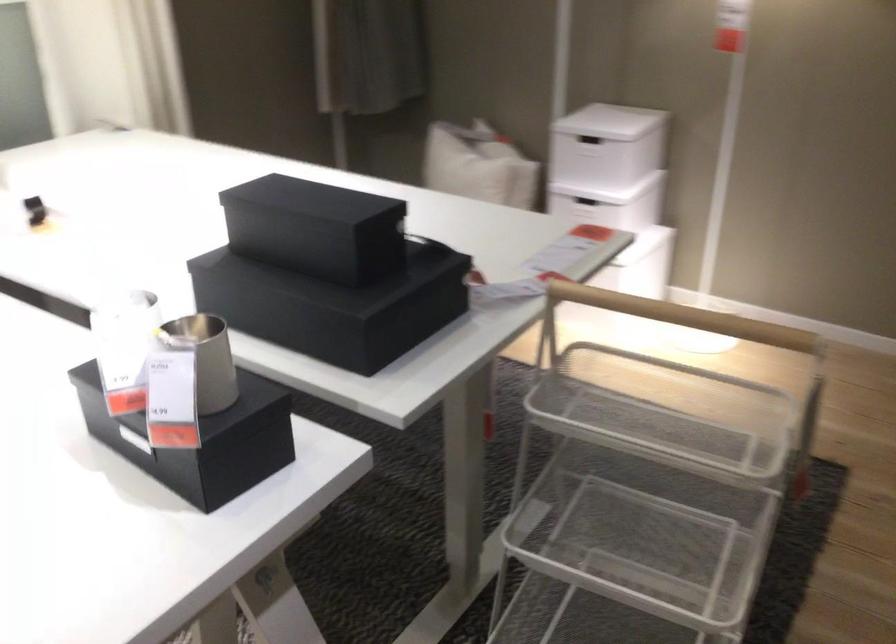
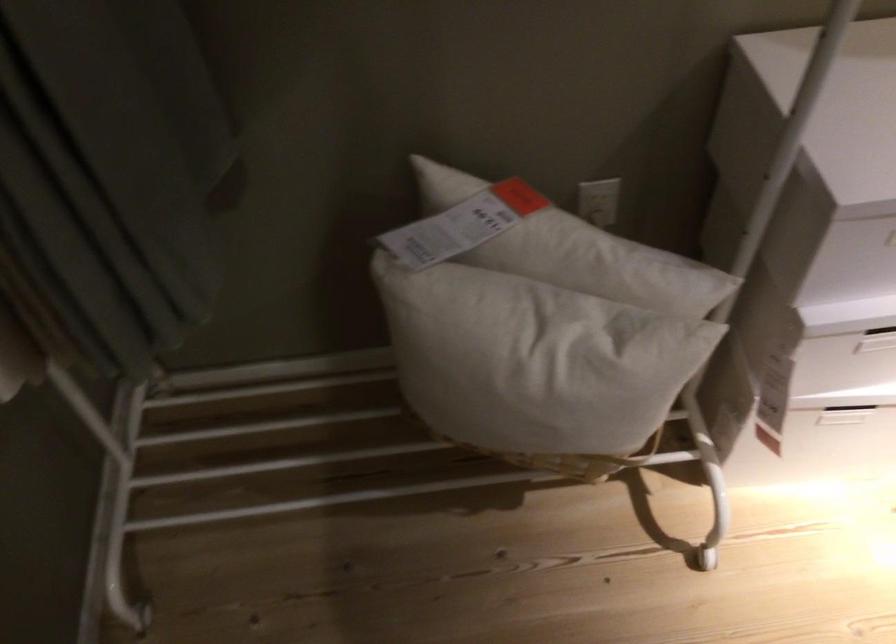
In the second image, find the point that corresponds to (584,192) in the first image.

(874, 328)